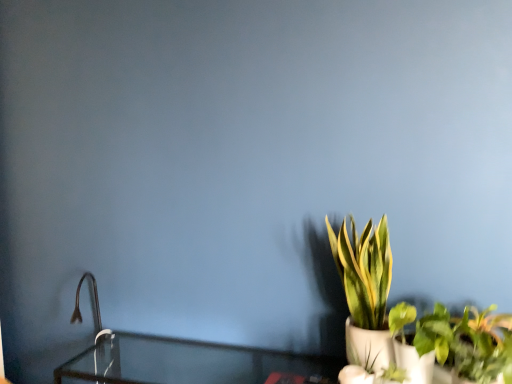
Question: Does matte black faucet at left contain green leafy plant in white pot at right?

Choices:
 (A) no
 (B) yes

Answer: (A)

Question: Is matte black faucet at left in contact with green leafy plant in white pot at right?

Choices:
 (A) no
 (B) yes

Answer: (A)

Question: Considering the relative sizes of matte black faucet at left and green leafy plant in white pot at right in the image provided, is matte black faucet at left smaller than green leafy plant in white pot at right?

Choices:
 (A) no
 (B) yes

Answer: (B)

Question: From the image's perspective, would you say matte black faucet at left is positioned over green leafy plant in white pot at right?

Choices:
 (A) no
 (B) yes

Answer: (A)

Question: From the image's perspective, is matte black faucet at left beneath green leafy plant in white pot at right?

Choices:
 (A) yes
 (B) no

Answer: (A)

Question: Would you say green leafy plant at lower right is to the left or to the right of matte black faucet at left in the picture?

Choices:
 (A) right
 (B) left

Answer: (A)

Question: In the image, is green leafy plant at lower right positioned in front of or behind matte black faucet at left?

Choices:
 (A) front
 (B) behind

Answer: (A)

Question: From the image's perspective, is green leafy plant at lower right positioned above or below matte black faucet at left?

Choices:
 (A) below
 (B) above

Answer: (A)

Question: From a real-world perspective, is green leafy plant at lower right above or below matte black faucet at left?

Choices:
 (A) above
 (B) below

Answer: (B)

Question: Relative to matte black faucet at left, is green leafy plant in white pot at right in front or behind?

Choices:
 (A) front
 (B) behind

Answer: (A)

Question: In terms of width, does green leafy plant in white pot at right look wider or thinner when compared to matte black faucet at left?

Choices:
 (A) thin
 (B) wide

Answer: (A)

Question: From a real-world perspective, is green leafy plant in white pot at right positioned above or below matte black faucet at left?

Choices:
 (A) below
 (B) above

Answer: (B)

Question: From the image's perspective, relative to matte black faucet at left, is green leafy plant in white pot at right above or below?

Choices:
 (A) above
 (B) below

Answer: (A)

Question: From the image's perspective, relative to green leafy plant in white pot at right, is matte black faucet at left above or below?

Choices:
 (A) below
 (B) above

Answer: (A)

Question: Considering the positions of matte black faucet at left and green leafy plant in white pot at right in the image, is matte black faucet at left taller or shorter than green leafy plant in white pot at right?

Choices:
 (A) short
 (B) tall

Answer: (A)